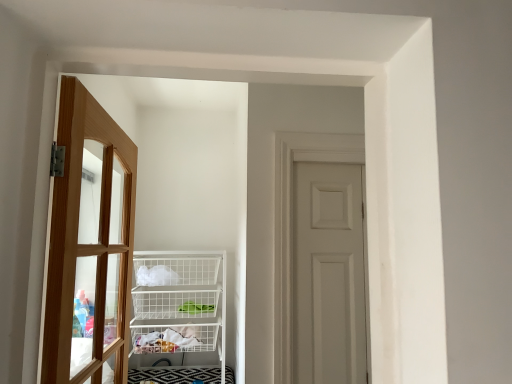
Identify the location of vacant area on top of white matte door at center, placed as the 1th door when sorted from right to left (from a real-world perspective). (328, 164).